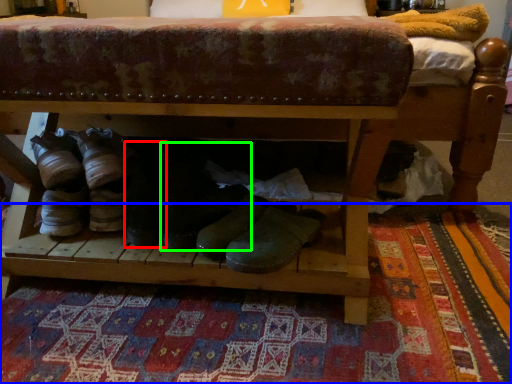
Question: Estimate the real-world distances between objects in this image. Which object is closer to footwear (highlighted by a red box), mat (highlighted by a blue box) or footwear (highlighted by a green box)?

Choices:
 (A) mat
 (B) footwear

Answer: (B)